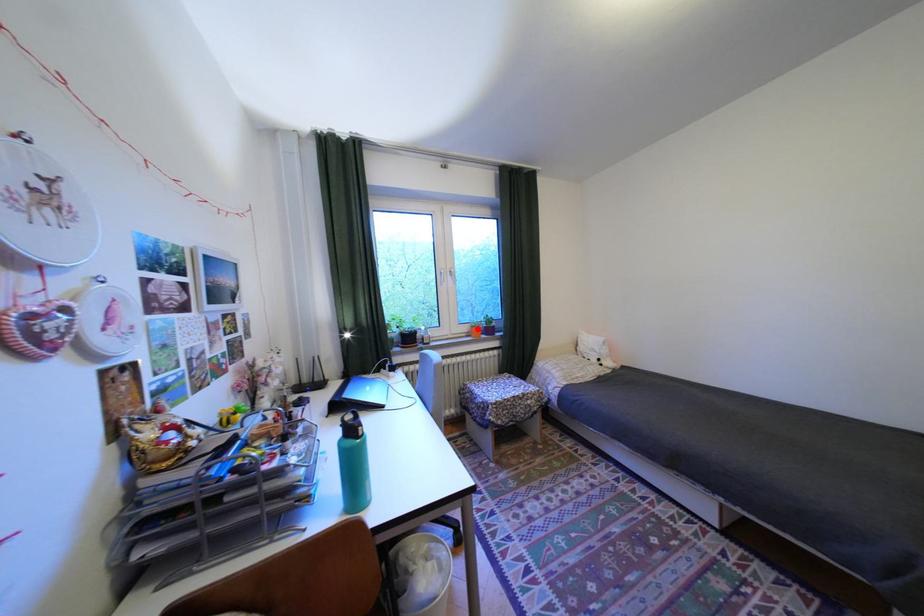
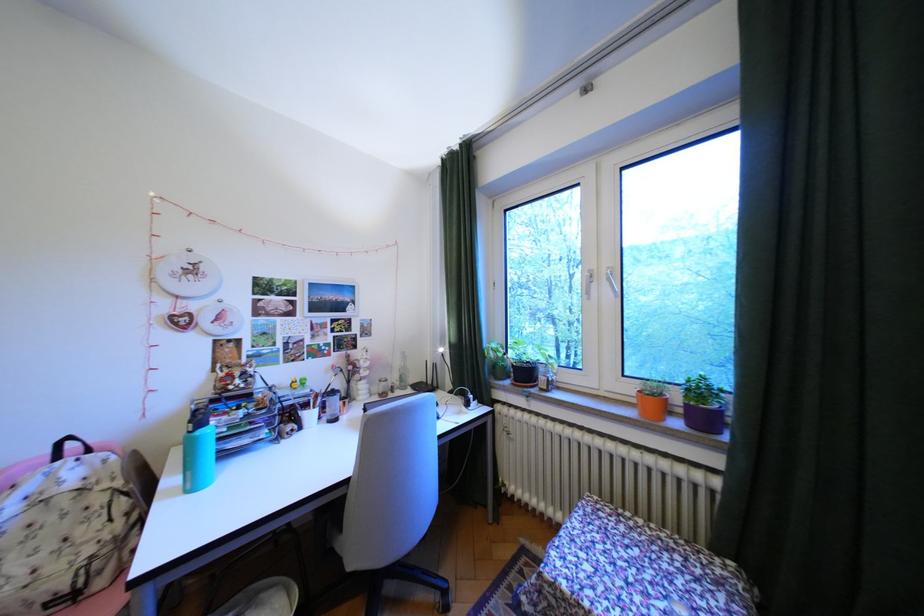
Locate, in the second image, the point that corresponds to the highlighted location in the first image.

(641, 390)